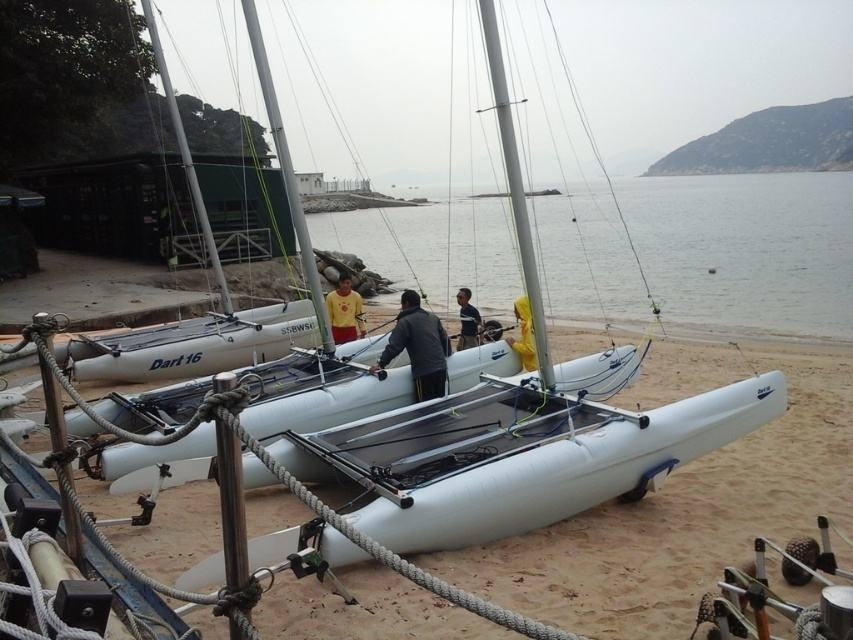
Is dark gray fabric jacket at center closer to the viewer compared to yellow fabric shirt at center?

Yes, dark gray fabric jacket at center is closer to the viewer.

The width and height of the screenshot is (853, 640). What are the coordinates of `dark gray fabric jacket at center` in the screenshot? It's located at (418, 346).

Between point (430, 328) and point (474, 346), which one is positioned in front?

Point (430, 328) is in front.

Identify the location of dark gray fabric jacket at center. (418, 346).

Who is shorter, dark gray fabric jacket at center or yellow waterproof jacket at center?

yellow waterproof jacket at center

Which is in front, point (425, 392) or point (527, 352)?

Positioned in front is point (425, 392).

Locate an element on the screen. The width and height of the screenshot is (853, 640). dark gray fabric jacket at center is located at coordinates (418, 346).

Between white matte water at center and white matte sailboat at center, which one has more height?

With more height is white matte water at center.

Is white matte water at center wider than white matte sailboat at center?

Yes, white matte water at center is wider than white matte sailboat at center.

Does point (838, 241) lie behind point (363, 376)?

Yes, it is.

The height and width of the screenshot is (640, 853). Identify the location of white matte water at center. (747, 250).